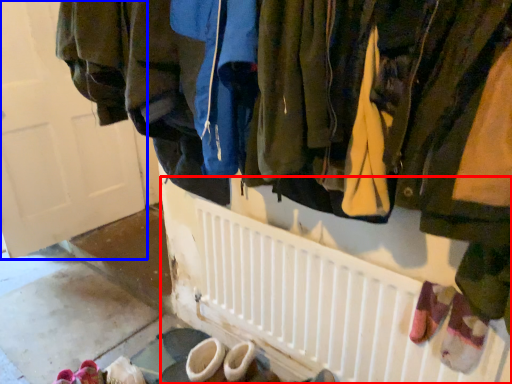
Question: Which of the following is the closest to the observer, radiator (highlighted by a red box) or door (highlighted by a blue box)?

Choices:
 (A) radiator
 (B) door

Answer: (A)